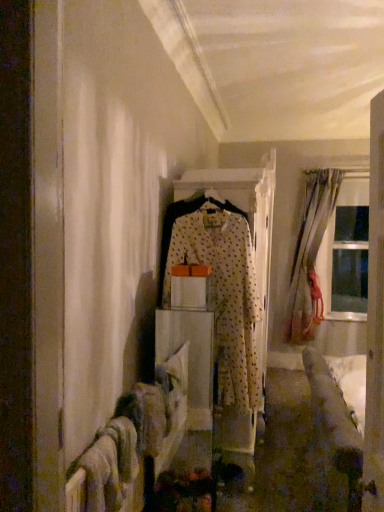
Question: Would you say white dotted fabric at center contains wooden door at right?

Choices:
 (A) yes
 (B) no

Answer: (B)

Question: Can you confirm if white dotted fabric at center is shorter than wooden door at right?

Choices:
 (A) no
 (B) yes

Answer: (B)

Question: Is white dotted fabric at center at the left side of wooden door at right?

Choices:
 (A) yes
 (B) no

Answer: (A)

Question: Can you confirm if white dotted fabric at center is positioned to the right of wooden door at right?

Choices:
 (A) no
 (B) yes

Answer: (A)

Question: Considering the relative positions of white dotted fabric at center and wooden door at right in the image provided, is white dotted fabric at center in front of wooden door at right?

Choices:
 (A) yes
 (B) no

Answer: (B)

Question: Is transparent glass window at right inside the boundaries of silky beige curtain at right, or outside?

Choices:
 (A) outside
 (B) inside

Answer: (A)

Question: In terms of width, does transparent glass window at right look wider or thinner when compared to silky beige curtain at right?

Choices:
 (A) thin
 (B) wide

Answer: (A)

Question: Is point (336, 238) positioned closer to the camera than point (307, 337)?

Choices:
 (A) farther
 (B) closer

Answer: (A)

Question: Is transparent glass window at right taller or shorter than silky beige curtain at right?

Choices:
 (A) tall
 (B) short

Answer: (B)

Question: From the image's perspective, is white dotted fabric at center above or below wooden door at right?

Choices:
 (A) above
 (B) below

Answer: (B)

Question: In terms of width, does white dotted fabric at center look wider or thinner when compared to wooden door at right?

Choices:
 (A) thin
 (B) wide

Answer: (B)

Question: In terms of size, does white dotted fabric at center appear bigger or smaller than wooden door at right?

Choices:
 (A) big
 (B) small

Answer: (A)

Question: Does point (177, 215) appear closer or farther from the camera than point (377, 134)?

Choices:
 (A) farther
 (B) closer

Answer: (B)

Question: Considering the positions of point (195, 390) and point (302, 339), is point (195, 390) closer or farther from the camera than point (302, 339)?

Choices:
 (A) farther
 (B) closer

Answer: (B)

Question: In terms of height, does white fabric at center look taller or shorter compared to silky beige curtain at right?

Choices:
 (A) short
 (B) tall

Answer: (A)